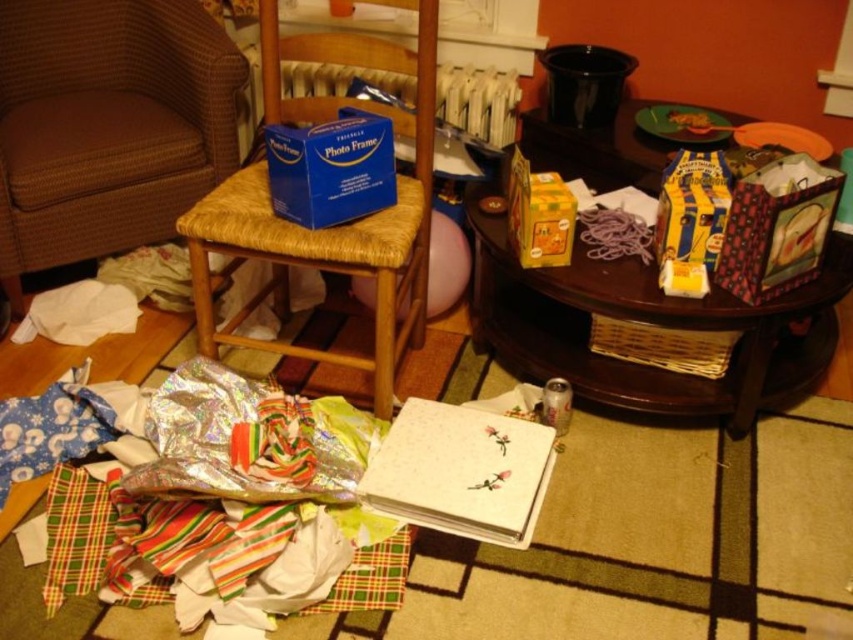
Based on the photo, you are standing in the living room and need to reach both points. Which point, point (375,148) or point (566,186), is closer to you?

Point (375,148) is closer to the viewer than point (566,186).

In the scene shown: You are a cleaning robot with a width of 6 inches. You need to move from the brown woven chair at left to the blue cardboard photo frame at center. Can you fit through the space between them without moving any items?

The distance between the brown woven chair at left and the blue cardboard photo frame at center is 5.91 inches, which is narrower than your 6 inch width. Therefore, you cannot fit through the space without moving items.